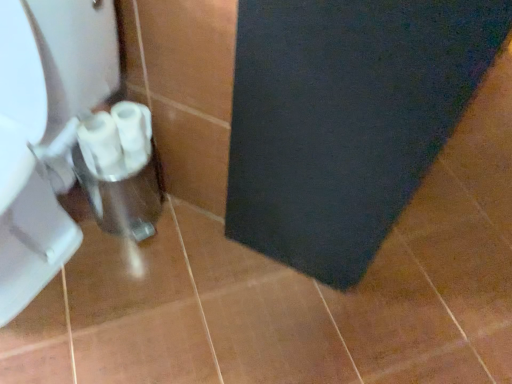
What do you see at coordinates (134, 133) in the screenshot? The image size is (512, 384). I see `white plastic toilet paper at lower left, which is the 1th toilet paper in right-to-left order` at bounding box center [134, 133].

At what (x,y) coordinates should I click in order to perform the action: click on white glossy toilet paper at lower left, the first toilet paper when ordered from left to right. Please return your answer as a coordinate pair (x, y). The width and height of the screenshot is (512, 384). Looking at the image, I should click on (99, 141).

I want to click on dark blue felt bath mat at lower right, so click(x=345, y=119).

This screenshot has width=512, height=384. I want to click on white plastic toilet paper at lower left, which is the 1th toilet paper in right-to-left order, so click(x=134, y=133).

Find the location of a particular element. toilet that appears on the left of dark blue felt bath mat at lower right is located at coordinates (45, 130).

From a real-world perspective, is dark blue felt bath mat at lower right above or below white glossy toilet at left?

dark blue felt bath mat at lower right is situated higher than white glossy toilet at left in the real world.

Is the depth of dark blue felt bath mat at lower right greater than that of white glossy toilet at left?

Yes, dark blue felt bath mat at lower right is further from the camera.

From the image's perspective, is dark blue felt bath mat at lower right located above or below white glossy toilet at left?

Based on their image positions, dark blue felt bath mat at lower right is located above white glossy toilet at left.

Do you think dark blue felt bath mat at lower right is within white plastic toilet paper at lower left, the 2th toilet paper in the left-to-right sequence, or outside of it?

dark blue felt bath mat at lower right is spatially situated outside white plastic toilet paper at lower left, the 2th toilet paper in the left-to-right sequence.

From a real-world perspective, is dark blue felt bath mat at lower right under white plastic toilet paper at lower left, the 2th toilet paper in the left-to-right sequence?

No.

Can you confirm if dark blue felt bath mat at lower right is taller than white plastic toilet paper at lower left, which is the 1th toilet paper in right-to-left order?

Yes.

Considering the sizes of objects white glossy toilet at left and white glossy toilet paper at lower left, the first toilet paper when ordered from left to right, in the image provided, who is shorter, white glossy toilet at left or white glossy toilet paper at lower left, the first toilet paper when ordered from left to right,?

Standing shorter between the two is white glossy toilet paper at lower left, the first toilet paper when ordered from left to right.

Is white glossy toilet at left situated inside white glossy toilet paper at lower left, the first toilet paper when ordered from left to right, or outside?

white glossy toilet at left is located beyond the bounds of white glossy toilet paper at lower left, the first toilet paper when ordered from left to right.

Considering the sizes of white glossy toilet at left and white glossy toilet paper at lower left, the second toilet paper in the right-to-left sequence, in the image, is white glossy toilet at left bigger or smaller than white glossy toilet paper at lower left, the second toilet paper in the right-to-left sequence,?

white glossy toilet at left is bigger than white glossy toilet paper at lower left, the second toilet paper in the right-to-left sequence.

Is point (93, 97) closer to camera compared to point (110, 160)?

Yes, it is in front of point (110, 160).

Is white glossy toilet paper at lower left, the second toilet paper in the right-to-left sequence, far away from white plastic toilet paper at lower left, the 2th toilet paper in the left-to-right sequence?

A: white glossy toilet paper at lower left, the second toilet paper in the right-to-left sequence, is actually quite close to white plastic toilet paper at lower left, the 2th toilet paper in the left-to-right sequence.

Measure the distance from white glossy toilet paper at lower left, the first toilet paper when ordered from left to right, to white plastic toilet paper at lower left, which is the 1th toilet paper in right-to-left order.

white glossy toilet paper at lower left, the first toilet paper when ordered from left to right, and white plastic toilet paper at lower left, which is the 1th toilet paper in right-to-left order, are 1.90 inches apart from each other.

From the image's perspective, which one is positioned lower, white glossy toilet paper at lower left, the first toilet paper when ordered from left to right, or white plastic toilet paper at lower left, which is the 1th toilet paper in right-to-left order?

white glossy toilet paper at lower left, the first toilet paper when ordered from left to right, appears lower in the image.

Between white glossy toilet paper at lower left, the second toilet paper in the right-to-left sequence, and white plastic toilet paper at lower left, which is the 1th toilet paper in right-to-left order, which one has smaller size?

white plastic toilet paper at lower left, which is the 1th toilet paper in right-to-left order.

In the image, is white glossy toilet paper at lower left, the first toilet paper when ordered from left to right, positioned in front of or behind dark blue felt bath mat at lower right?

Visually, white glossy toilet paper at lower left, the first toilet paper when ordered from left to right, is located behind dark blue felt bath mat at lower right.

From the image's perspective, is white glossy toilet paper at lower left, the first toilet paper when ordered from left to right, positioned above or below dark blue felt bath mat at lower right?

white glossy toilet paper at lower left, the first toilet paper when ordered from left to right, is below dark blue felt bath mat at lower right.

In terms of width, does white glossy toilet paper at lower left, the first toilet paper when ordered from left to right, look wider or thinner when compared to dark blue felt bath mat at lower right?

In the image, white glossy toilet paper at lower left, the first toilet paper when ordered from left to right, appears to be more narrow than dark blue felt bath mat at lower right.

From a real-world perspective, does dark blue felt bath mat at lower right sit lower than white glossy toilet paper at lower left, the second toilet paper in the right-to-left sequence?

No, from a real-world perspective, dark blue felt bath mat at lower right is not beneath white glossy toilet paper at lower left, the second toilet paper in the right-to-left sequence.

Is white glossy toilet paper at lower left, the first toilet paper when ordered from left to right, at the back of dark blue felt bath mat at lower right?

Yes.

Find the location of a particular element. The width and height of the screenshot is (512, 384). bath mat located above the white glossy toilet paper at lower left, the second toilet paper in the right-to-left sequence (from the image's perspective) is located at coordinates (345, 119).

Is white glossy toilet at left not near white plastic toilet paper at lower left, the 2th toilet paper in the left-to-right sequence?

They are positioned close to each other.

Considering the relative sizes of white glossy toilet at left and white plastic toilet paper at lower left, which is the 1th toilet paper in right-to-left order, in the image provided, is white glossy toilet at left thinner than white plastic toilet paper at lower left, which is the 1th toilet paper in right-to-left order,?

Incorrect, the width of white glossy toilet at left is not less than that of white plastic toilet paper at lower left, which is the 1th toilet paper in right-to-left order.

Which object is positioned more to the left, white glossy toilet at left or white plastic toilet paper at lower left, which is the 1th toilet paper in right-to-left order?

From the viewer's perspective, white glossy toilet at left appears more on the left side.

Identify the location of bath mat located on the right of white glossy toilet at left. This screenshot has width=512, height=384. (345, 119).

From the dark blue felt bath mat at lower right, count the 1st toilet paper to the left and point to it. Please provide its 2D coordinates.

[(134, 133)]

Considering their positions, is white glossy toilet at left positioned closer to white plastic toilet paper at lower left, which is the 1th toilet paper in right-to-left order, than dark blue felt bath mat at lower right?

The object closer to white plastic toilet paper at lower left, which is the 1th toilet paper in right-to-left order, is white glossy toilet at left.

Considering their positions, is white glossy toilet paper at lower left, the first toilet paper when ordered from left to right, positioned further to dark blue felt bath mat at lower right than white glossy toilet at left?

white glossy toilet paper at lower left, the first toilet paper when ordered from left to right, is further to dark blue felt bath mat at lower right.

From the image, which object appears to be farther from white glossy toilet paper at lower left, the second toilet paper in the right-to-left sequence, dark blue felt bath mat at lower right or white plastic toilet paper at lower left, which is the 1th toilet paper in right-to-left order?

dark blue felt bath mat at lower right lies further to white glossy toilet paper at lower left, the second toilet paper in the right-to-left sequence, than the other object.

Based on their spatial positions, is white glossy toilet at left or white glossy toilet paper at lower left, the first toilet paper when ordered from left to right, further from white plastic toilet paper at lower left, which is the 1th toilet paper in right-to-left order?

white glossy toilet at left is further to white plastic toilet paper at lower left, which is the 1th toilet paper in right-to-left order.

From the image, which object appears to be nearer to dark blue felt bath mat at lower right, white plastic toilet paper at lower left, which is the 1th toilet paper in right-to-left order, or white glossy toilet at left?

white plastic toilet paper at lower left, which is the 1th toilet paper in right-to-left order, is closer to dark blue felt bath mat at lower right.

From the image, which object appears to be nearer to white plastic toilet paper at lower left, which is the 1th toilet paper in right-to-left order, dark blue felt bath mat at lower right or white glossy toilet at left?

white glossy toilet at left.

Based on the photo, looking at the image, which one is located closer to white glossy toilet at left, dark blue felt bath mat at lower right or white glossy toilet paper at lower left, the first toilet paper when ordered from left to right?

Among the two, white glossy toilet paper at lower left, the first toilet paper when ordered from left to right, is located nearer to white glossy toilet at left.

Considering their positions, is white glossy toilet paper at lower left, the first toilet paper when ordered from left to right, positioned further to white plastic toilet paper at lower left, which is the 1th toilet paper in right-to-left order, than white glossy toilet at left?

The object further to white plastic toilet paper at lower left, which is the 1th toilet paper in right-to-left order, is white glossy toilet at left.

Identify the location of toilet paper located between white glossy toilet paper at lower left, the first toilet paper when ordered from left to right, and dark blue felt bath mat at lower right in the left-right direction. Image resolution: width=512 pixels, height=384 pixels. (134, 133).

The height and width of the screenshot is (384, 512). Identify the location of toilet paper located between white glossy toilet at left and white plastic toilet paper at lower left, the 2th toilet paper in the left-to-right sequence, in the depth direction. (99, 141).